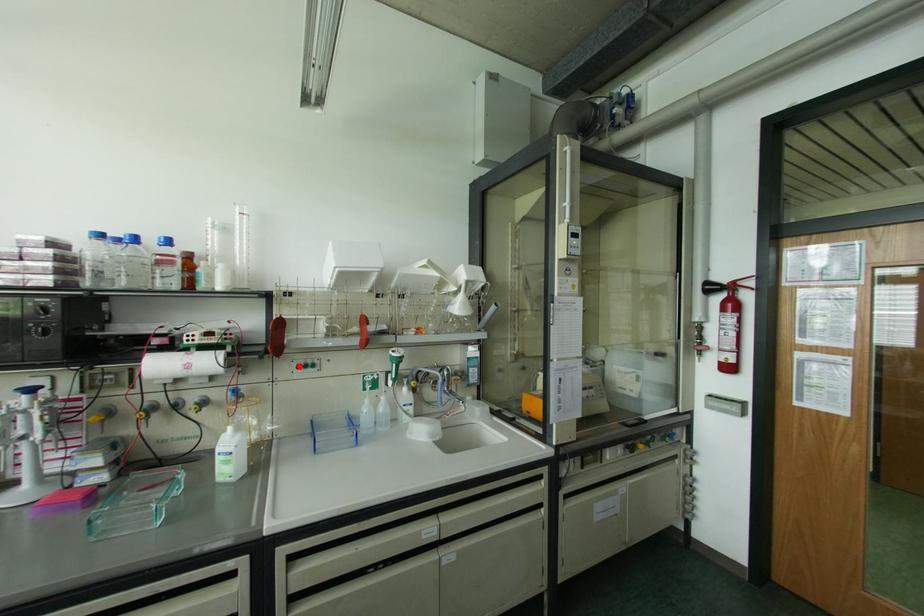
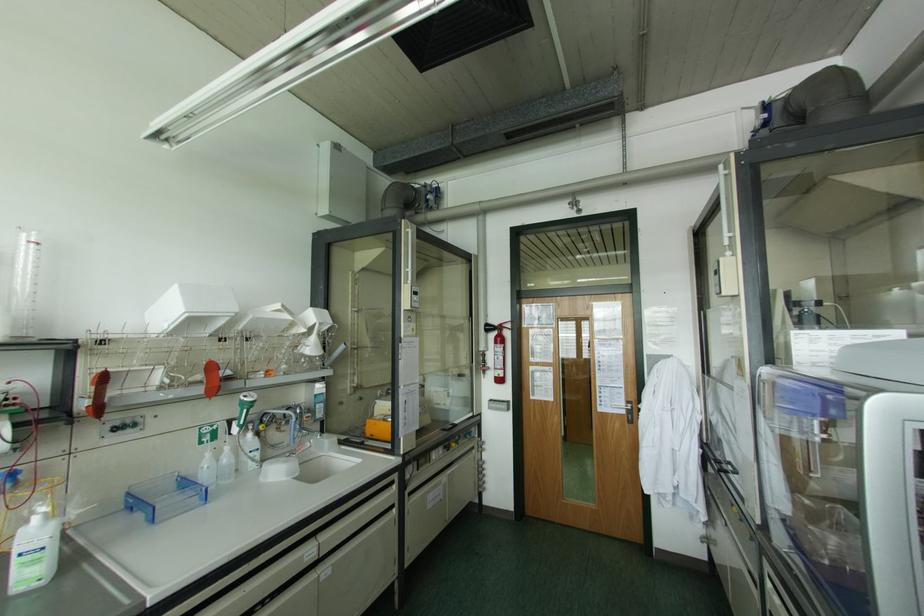
Locate, in the second image, the point that corresponds to the highlighted location in the first image.

(115, 428)